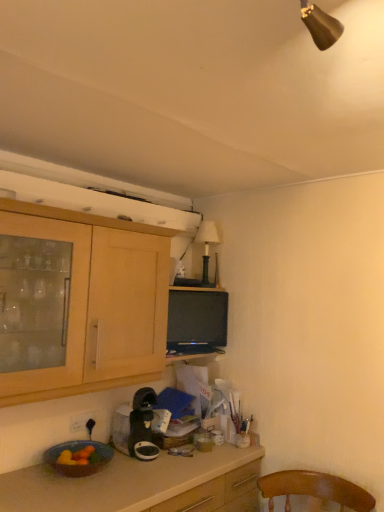
Question: From the image's perspective, is white plastic power outlet at lower left below matte ceramic bowl at lower left?

Choices:
 (A) no
 (B) yes

Answer: (A)

Question: From a real-world perspective, is white plastic power outlet at lower left located higher than matte ceramic bowl at lower left?

Choices:
 (A) yes
 (B) no

Answer: (A)

Question: Is white plastic power outlet at lower left behind matte ceramic bowl at lower left?

Choices:
 (A) no
 (B) yes

Answer: (B)

Question: Is white plastic power outlet at lower left next to matte ceramic bowl at lower left?

Choices:
 (A) yes
 (B) no

Answer: (B)

Question: Is white plastic power outlet at lower left taller than matte ceramic bowl at lower left?

Choices:
 (A) no
 (B) yes

Answer: (A)

Question: Would you say matte ceramic bowl at lower left is to the left or to the right of matte black tv at center in the picture?

Choices:
 (A) left
 (B) right

Answer: (A)

Question: Based on their sizes in the image, would you say matte ceramic bowl at lower left is bigger or smaller than matte black tv at center?

Choices:
 (A) big
 (B) small

Answer: (B)

Question: From a real-world perspective, relative to matte black tv at center, is matte ceramic bowl at lower left vertically above or below?

Choices:
 (A) above
 (B) below

Answer: (B)

Question: Is matte ceramic bowl at lower left inside or outside of matte black tv at center?

Choices:
 (A) outside
 (B) inside

Answer: (A)

Question: Choose the correct answer: Is black plastic coffee maker at lower center inside green matte lamp at upper center or outside it?

Choices:
 (A) inside
 (B) outside

Answer: (B)

Question: Considering the positions of black plastic coffee maker at lower center and green matte lamp at upper center in the image, is black plastic coffee maker at lower center taller or shorter than green matte lamp at upper center?

Choices:
 (A) short
 (B) tall

Answer: (A)

Question: Looking at the image, does black plastic coffee maker at lower center seem bigger or smaller compared to green matte lamp at upper center?

Choices:
 (A) small
 (B) big

Answer: (B)

Question: Is black plastic coffee maker at lower center in front of or behind green matte lamp at upper center in the image?

Choices:
 (A) front
 (B) behind

Answer: (A)

Question: From the image's perspective, is green matte lamp at upper center positioned above or below light wood cabinet at upper left?

Choices:
 (A) below
 (B) above

Answer: (B)

Question: In terms of width, does green matte lamp at upper center look wider or thinner when compared to light wood cabinet at upper left?

Choices:
 (A) thin
 (B) wide

Answer: (A)